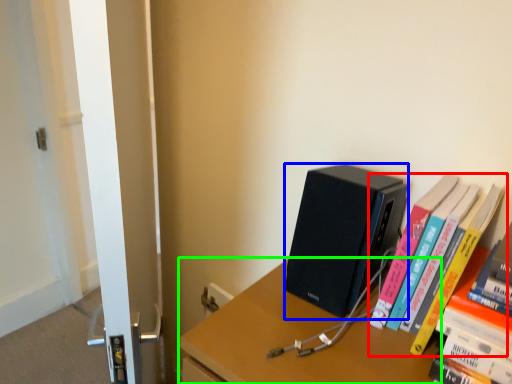
Question: Which object is the farthest from book (highlighted by a red box)? Choose among these: computer (highlighted by a blue box) or desk (highlighted by a green box).

Choices:
 (A) computer
 (B) desk

Answer: (B)